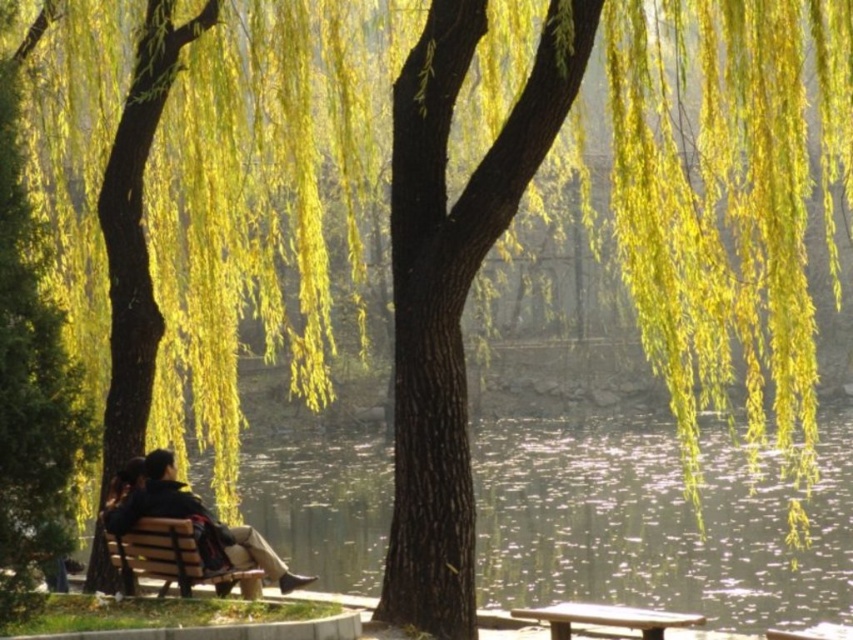
Based on the photo, does dark brown leather bench at lower left appear on the right side of wooden park bench at center?

No, dark brown leather bench at lower left is not to the right of wooden park bench at center.

Can you confirm if dark brown leather bench at lower left is shorter than wooden park bench at center?

No, dark brown leather bench at lower left is not shorter than wooden park bench at center.

Between point (120, 472) and point (643, 609), which one is positioned behind?

Point (643, 609)

Where is `dark brown leather bench at lower left`? The height and width of the screenshot is (640, 853). dark brown leather bench at lower left is located at coordinates (189, 518).

Does dark brown leather bench at lower left lie behind wooden bench at center?

That is True.

The image size is (853, 640). I want to click on dark brown leather bench at lower left, so click(x=189, y=518).

You are a GUI agent. You are given a task and a screenshot of the screen. Output one action in this format:
    pyautogui.click(x=<x>, y=<y>)
    Task: Click on the dark brown leather bench at lower left
    This screenshot has width=853, height=640.
    Given the screenshot: What is the action you would take?
    pyautogui.click(x=189, y=518)

Does wooden bench at center have a lesser width compared to wooden park bench at center?

Yes.

Is point (160, 518) more distant than point (611, 611)?

Yes, point (160, 518) is farther from viewer.

Find the location of a particular element. The image size is (853, 640). wooden bench at center is located at coordinates (173, 557).